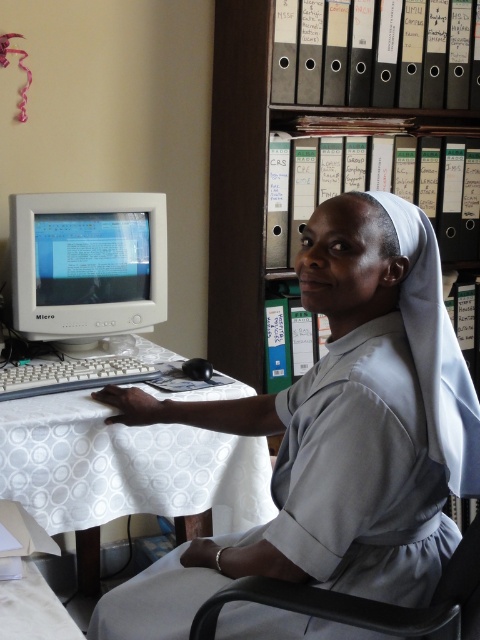
Does matte white monitor at left have a smaller size compared to black file folders at upper center?

Yes.

Between matte white monitor at left and black file folders at upper center, which one has less height?

Standing shorter between the two is matte white monitor at left.

Which is behind, point (15, 237) or point (216, 141)?

Positioned behind is point (216, 141).

Identify the location of matte white monitor at left. (86, 264).

Measure the distance between point (321, 465) and camera.

Point (321, 465) and camera are 3.42 feet apart.

Which is in front, point (308, 246) or point (259, 182)?

Positioned in front is point (308, 246).

Where is `gray matte nun's habit at center`? gray matte nun's habit at center is located at coordinates (336, 433).

Is point (323, 378) farther from camera compared to point (136, 193)?

No, it is not.

Find the location of `gray matte nun's habit at center`. gray matte nun's habit at center is located at coordinates (336, 433).